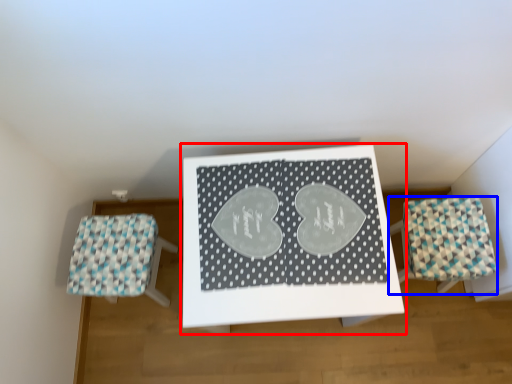
Question: Among these objects, which one is farthest to the camera, table (highlighted by a red box) or furniture (highlighted by a blue box)?

Choices:
 (A) table
 (B) furniture

Answer: (B)